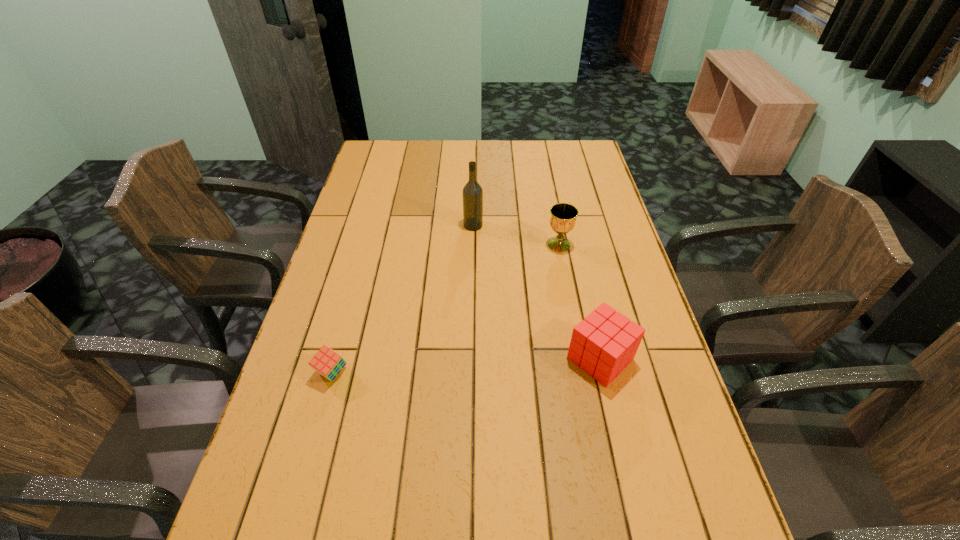
Identify the location of object located in the left edge section of the desktop. This screenshot has width=960, height=540. (327, 362).

I want to click on object that is at the right edge, so click(604, 343).

Where is `vacant space at the far edge of the desktop`? This screenshot has width=960, height=540. vacant space at the far edge of the desktop is located at coordinates (507, 162).

In order to click on free location at the left edge in this screenshot , I will do `click(270, 455)`.

Where is `vacant space at the right edge of the desktop`? vacant space at the right edge of the desktop is located at coordinates (670, 443).

At what (x,y) coordinates should I click in order to perform the action: click on blank space at the far left corner. Please return your answer as a coordinate pair (x, y). The height and width of the screenshot is (540, 960). Looking at the image, I should click on point(395,149).

Locate an element on the screen. The width and height of the screenshot is (960, 540). empty space between the vodka and the right cube is located at coordinates (537, 292).

You are a GUI agent. You are given a task and a screenshot of the screen. Output one action in this format:
    pyautogui.click(x=<x>, y=<y>)
    Task: Click on the vacant space that's between the chalice and the right cube
    
    Given the screenshot: What is the action you would take?
    pyautogui.click(x=580, y=302)

Where is `free spot between the second farthest object and the farthest object`? free spot between the second farthest object and the farthest object is located at coordinates [516, 235].

What are the coordinates of `free point between the farthest object and the shortest object` in the screenshot? It's located at (402, 299).